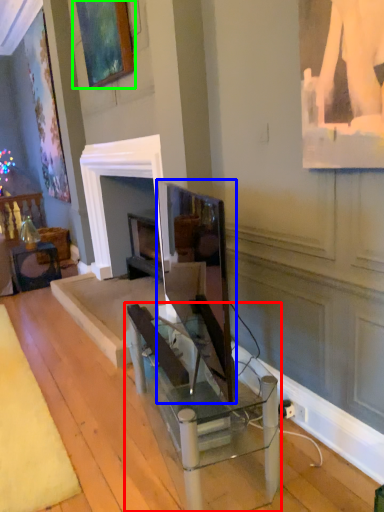
Question: Which is nearer to the table (highlighted by a red box)? computer monitor (highlighted by a blue box) or picture frame (highlighted by a green box).

Choices:
 (A) computer monitor
 (B) picture frame

Answer: (A)